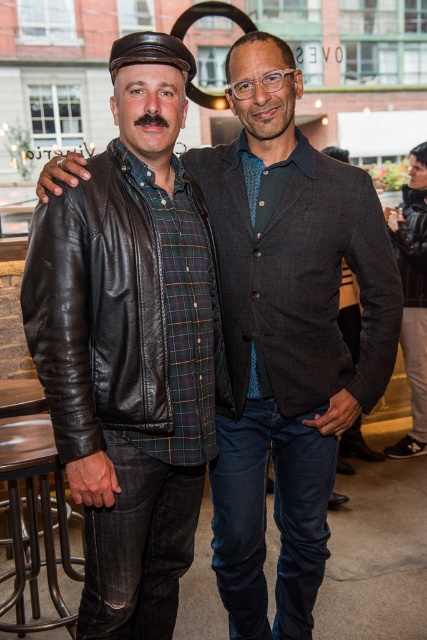
Question: Which object appears farthest from the camera in this image?

Choices:
 (A) leather jacket at lower right
 (B) metallic silver stool at lower left

Answer: (A)

Question: Is shiny black leather jacket at left thinner than metallic silver stool at lower left?

Choices:
 (A) yes
 (B) no

Answer: (B)

Question: Which object is farther from the camera taking this photo?

Choices:
 (A) metallic silver stool at lower left
 (B) shiny black leather jacket at left

Answer: (A)

Question: Is shiny black leather jacket at left positioned at the back of leather jacket at lower right?

Choices:
 (A) yes
 (B) no

Answer: (B)

Question: Does shiny black leather jacket at left have a lesser width compared to leather jacket at lower right?

Choices:
 (A) yes
 (B) no

Answer: (B)

Question: Considering the real-world distances, which object is closest to the shiny black leather jacket at left?

Choices:
 (A) leather jacket at lower right
 (B) metallic silver stool at lower left

Answer: (B)